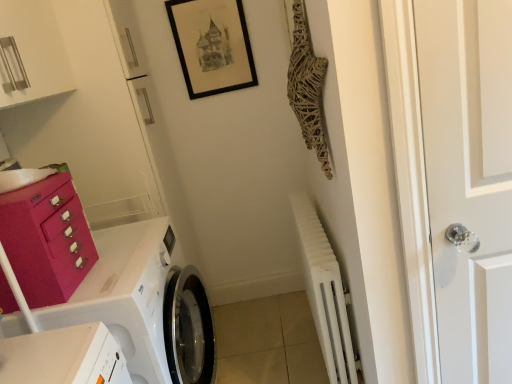
Question: From the image's perspective, is white matte radiator at lower right located above black matte picture frame at upper center?

Choices:
 (A) yes
 (B) no

Answer: (B)

Question: Can you confirm if white matte radiator at lower right is bigger than black matte picture frame at upper center?

Choices:
 (A) yes
 (B) no

Answer: (A)

Question: Is white matte radiator at lower right positioned before black matte picture frame at upper center?

Choices:
 (A) yes
 (B) no

Answer: (A)

Question: Is white matte radiator at lower right smaller than black matte picture frame at upper center?

Choices:
 (A) no
 (B) yes

Answer: (A)

Question: Considering the relative positions of white matte radiator at lower right and black matte picture frame at upper center in the image provided, is white matte radiator at lower right to the left of black matte picture frame at upper center from the viewer's perspective?

Choices:
 (A) no
 (B) yes

Answer: (A)

Question: From a real-world perspective, relative to white matte radiator at lower right, is white glossy washing machine at lower left vertically above or below?

Choices:
 (A) above
 (B) below

Answer: (A)

Question: Looking at their shapes, would you say white glossy washing machine at lower left is wider or thinner than white matte radiator at lower right?

Choices:
 (A) wide
 (B) thin

Answer: (A)

Question: Considering the positions of white glossy washing machine at lower left and white matte radiator at lower right in the image, is white glossy washing machine at lower left taller or shorter than white matte radiator at lower right?

Choices:
 (A) short
 (B) tall

Answer: (B)

Question: Does point (64, 312) appear closer or farther from the camera than point (318, 289)?

Choices:
 (A) closer
 (B) farther

Answer: (A)

Question: From a real-world perspective, is white matte radiator at lower right physically located above or below matte pink drawer at left?

Choices:
 (A) below
 (B) above

Answer: (A)

Question: Considering the positions of white matte radiator at lower right and matte pink drawer at left in the image, is white matte radiator at lower right bigger or smaller than matte pink drawer at left?

Choices:
 (A) small
 (B) big

Answer: (B)

Question: In terms of width, does white matte radiator at lower right look wider or thinner when compared to matte pink drawer at left?

Choices:
 (A) thin
 (B) wide

Answer: (A)

Question: In terms of height, does white matte radiator at lower right look taller or shorter compared to matte pink drawer at left?

Choices:
 (A) short
 (B) tall

Answer: (B)

Question: Considering the positions of point (484, 168) and point (27, 281), is point (484, 168) closer or farther from the camera than point (27, 281)?

Choices:
 (A) farther
 (B) closer

Answer: (B)

Question: Considering their positions, is white glass door handle at right located in front of or behind matte pink drawer at left?

Choices:
 (A) behind
 (B) front

Answer: (B)